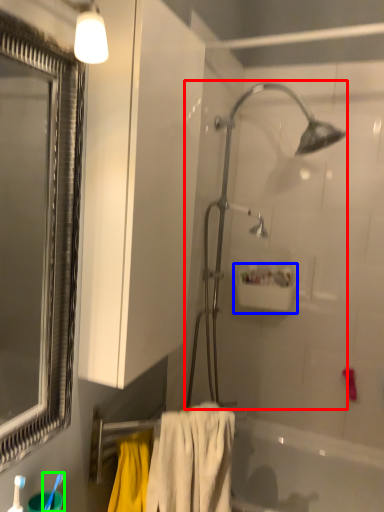
Question: Based on their relative distances, which object is farther from shower (highlighted by a red box)? Choose from sink (highlighted by a blue box) and toothbrush (highlighted by a green box).

Choices:
 (A) sink
 (B) toothbrush

Answer: (B)